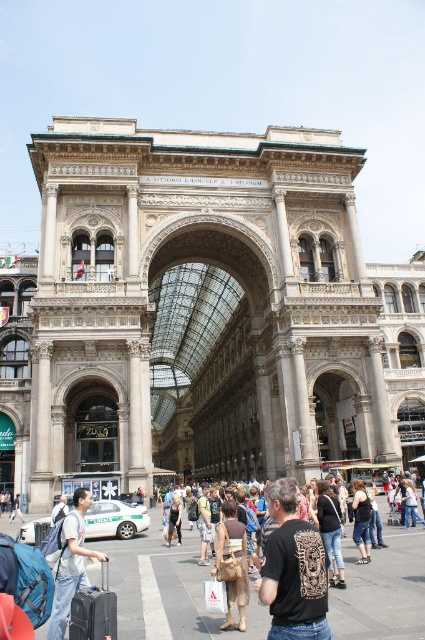
You are a delivery person with a cart that is 2 feet wide. You need to navigate through the busy street in the image to reach the entrance of the grand building. There is a matte black crowd at center and a black cotton tank top at center in your path. Can your cart fit through the gap between these two objects?

The distance between the matte black crowd at center and the black cotton tank top at center is 21.91 feet. Since your cart is only 2 feet wide, there is more than enough space for it to pass through the gap safely.

Please look at the point marked at coordinates (232, 564). What object is located exactly at that point?

The brown leather bag at center is located exactly at the point marked at coordinates (232, 564).